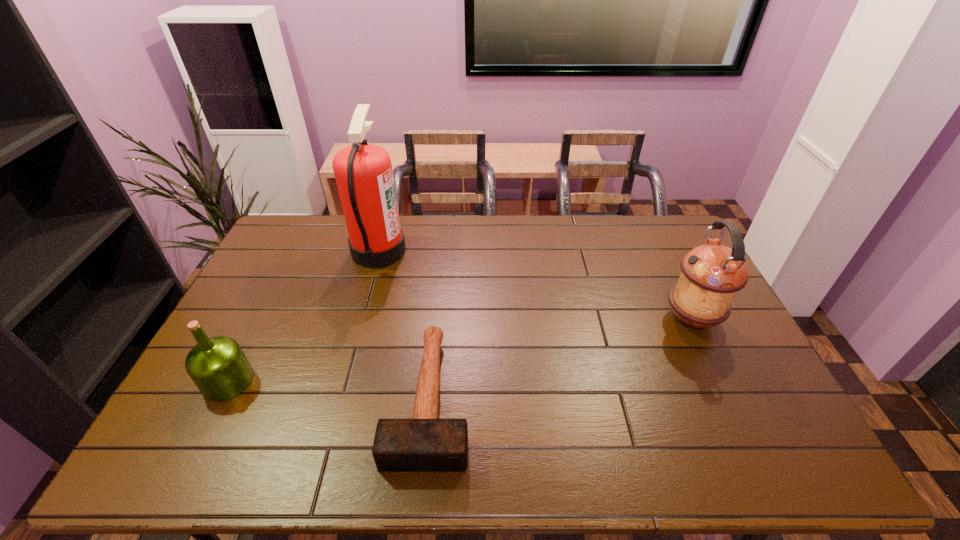
At what (x,y) coordinates should I click in order to perform the action: click on vacant area between the second object from left to right and the third shortest object. Please return your answer as a coordinate pair (x, y). The height and width of the screenshot is (540, 960). Looking at the image, I should click on (536, 285).

The image size is (960, 540). Find the location of `object identified as the third closest to the tallest object`. object identified as the third closest to the tallest object is located at coordinates (711, 275).

Select which object appears as the closest to the olive oil. Please provide its 2D coordinates. Your answer should be formatted as a tuple, i.e. [(x, y)], where the tuple contains the x and y coordinates of a point satisfying the conditions above.

[(363, 172)]

Where is `vacant region that satisfies the following two spatial constraints: 1. on the back side of the oil lamp; 2. on the right side of the third tallest object`? The height and width of the screenshot is (540, 960). vacant region that satisfies the following two spatial constraints: 1. on the back side of the oil lamp; 2. on the right side of the third tallest object is located at coordinates [x=259, y=319].

Where is `vacant region that satisfies the following two spatial constraints: 1. at the nozzle of the second object from left to right; 2. on the back side of the rightmost object`? The width and height of the screenshot is (960, 540). vacant region that satisfies the following two spatial constraints: 1. at the nozzle of the second object from left to right; 2. on the back side of the rightmost object is located at coordinates (360, 319).

The image size is (960, 540). In order to click on free point that satisfies the following two spatial constraints: 1. at the nozzle of the fire extinguisher; 2. on the left side of the second tallest object in this screenshot , I will do `click(360, 319)`.

Locate an element on the screen. The image size is (960, 540). blank area in the image that satisfies the following two spatial constraints: 1. on the back side of the rightmost object; 2. on the left side of the third tallest object is located at coordinates (259, 319).